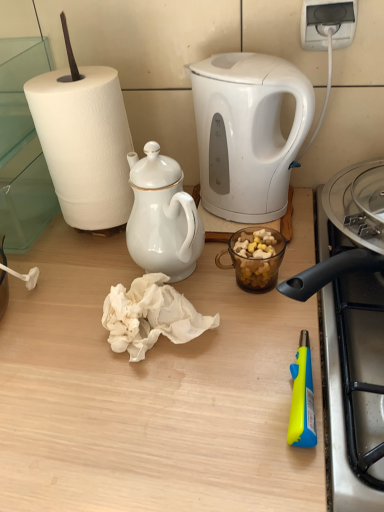
The width and height of the screenshot is (384, 512). In order to click on vacant location behind translucent glass mug at center in this screenshot , I will do `click(251, 229)`.